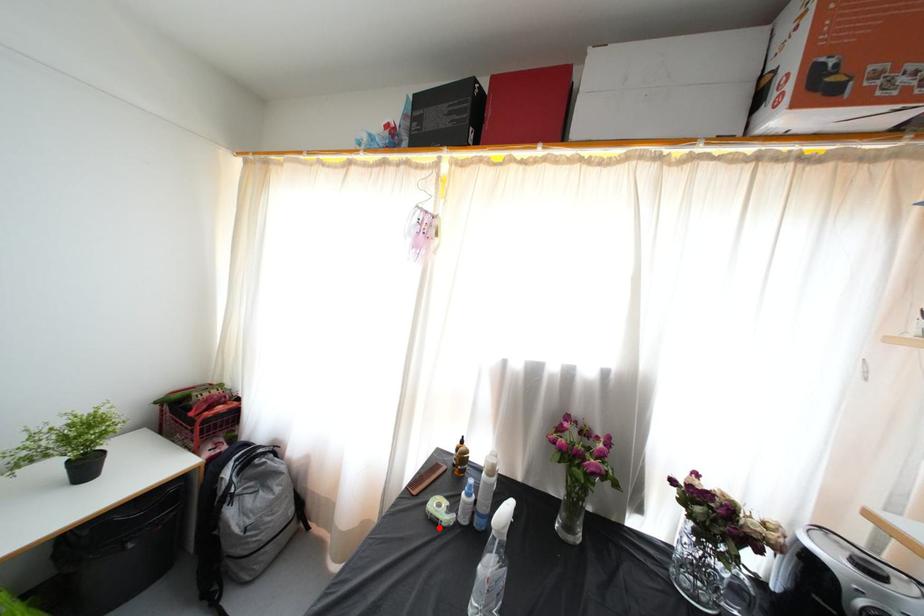
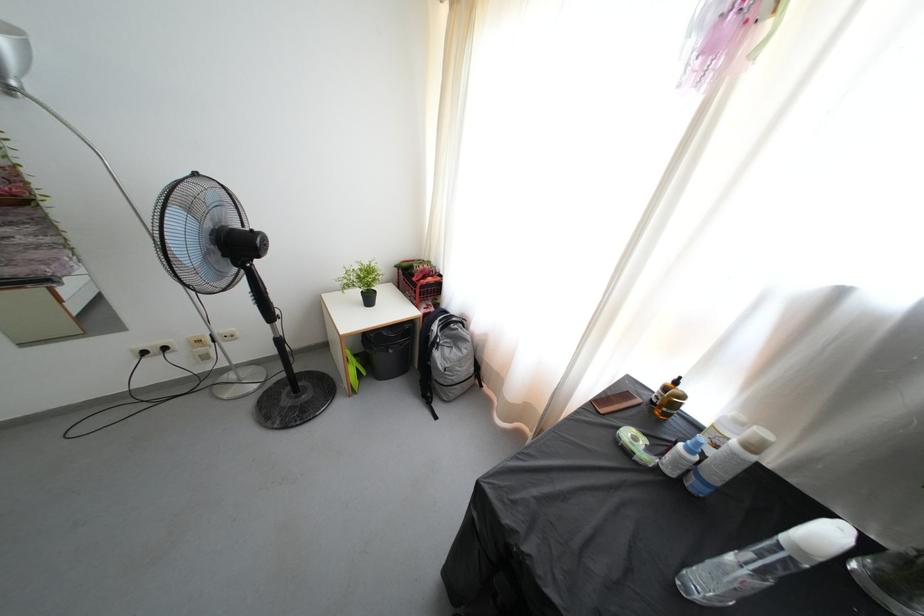
Find the pixel in the second image that matches the highlighted location in the first image.

(631, 458)